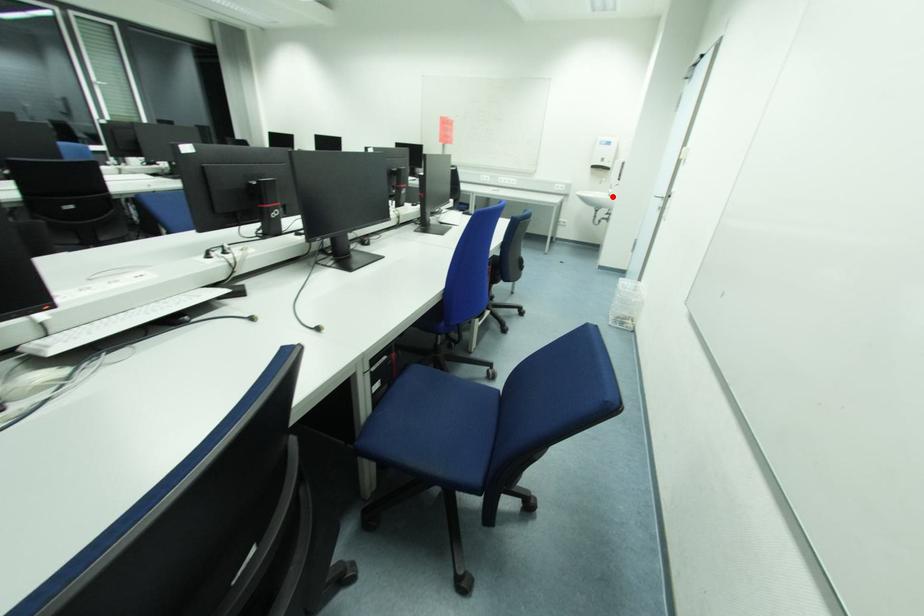
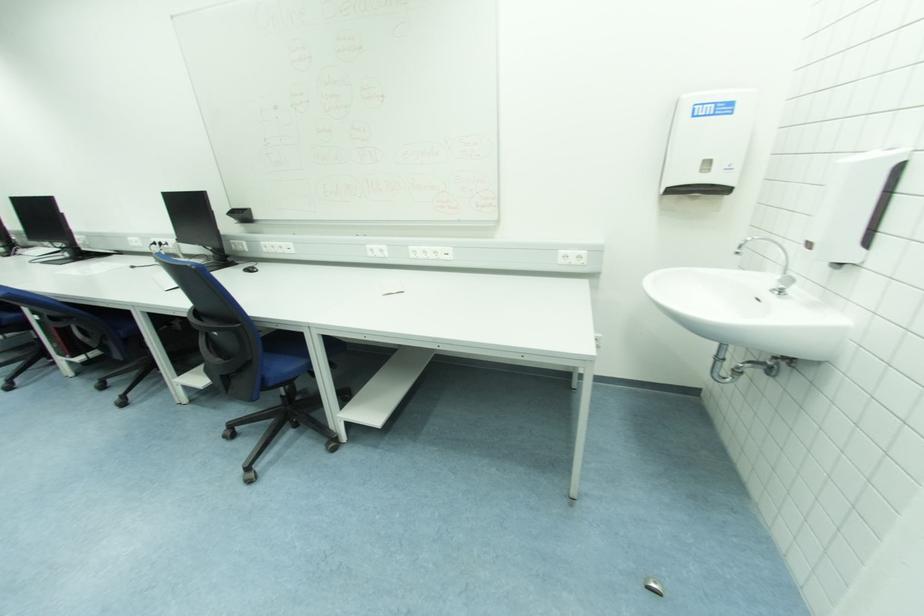
Question: I am providing you with two images of the same scene from different viewpoints. A red point is marked on the first image. Can you still see the location of the red point in image 2?

Choices:
 (A) Yes
 (B) No

Answer: (A)